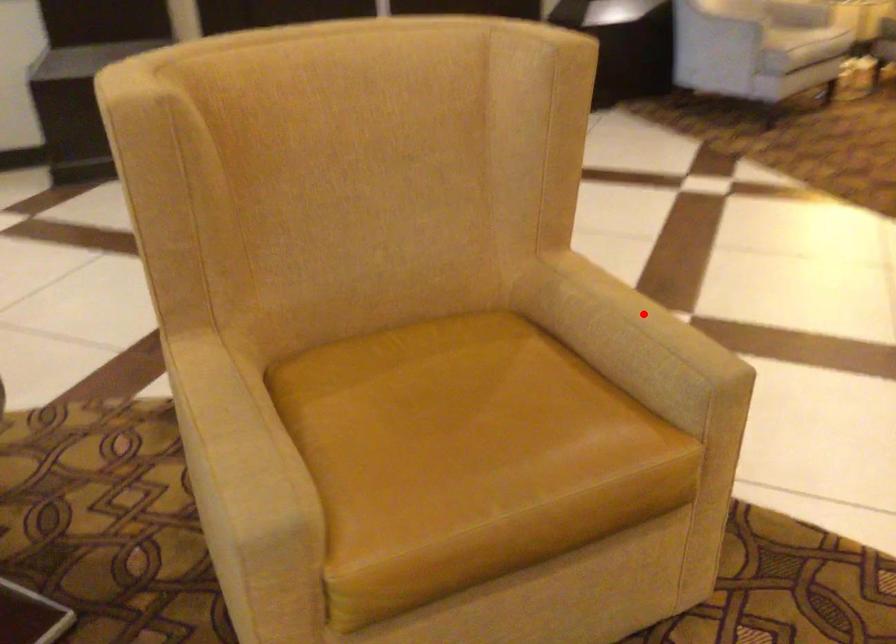
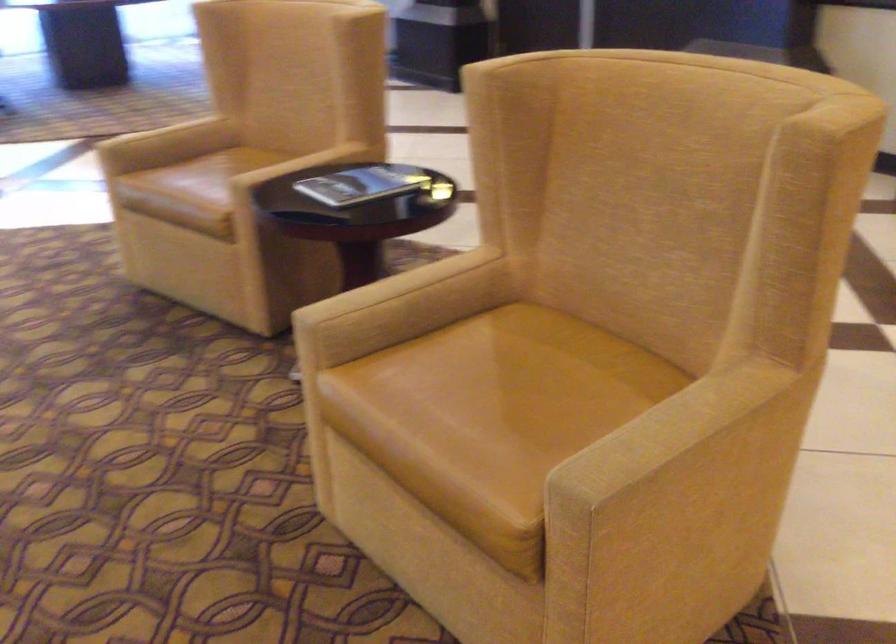
The point at the highlighted location is marked in the first image. Where is the corresponding point in the second image?

(707, 433)